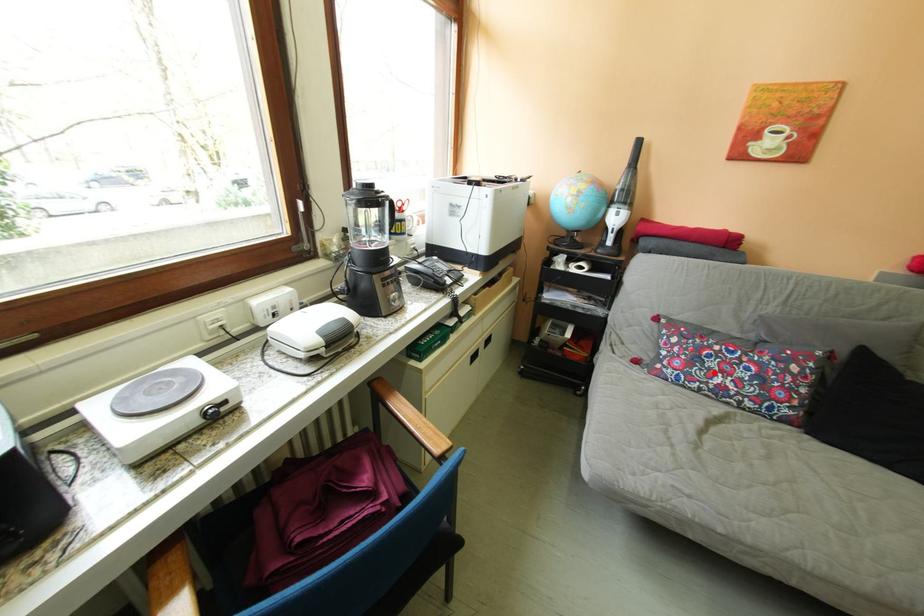
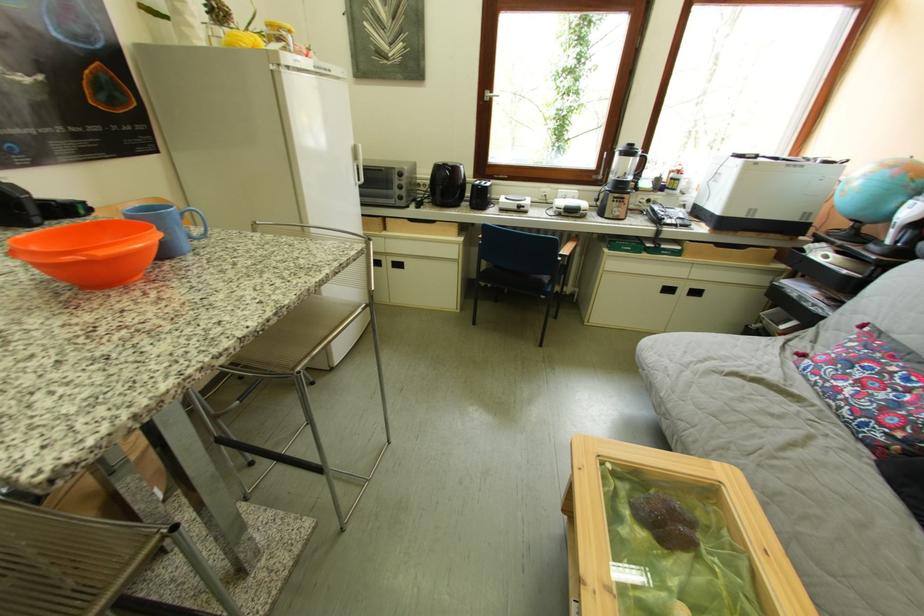
Question: I am providing you with two images of the same scene from different viewpoints. Given a red point in image1, look at the same physical point in image2. Is it:

Choices:
 (A) Closer to the viewpoint
 (B) Farther from the viewpoint

Answer: (B)